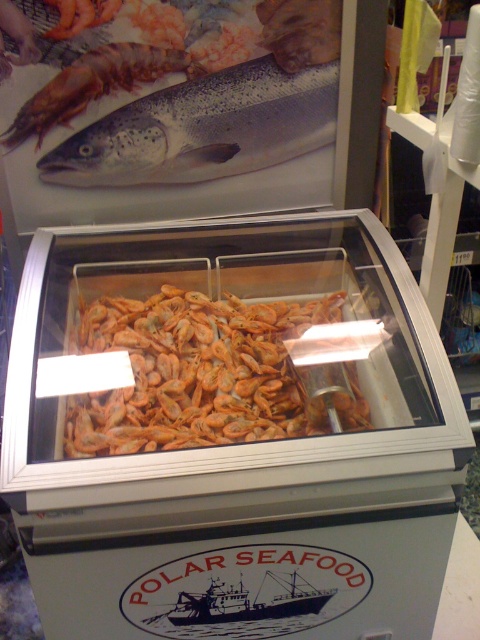
You are a customer at a seafood market and want to pick up the shiny orange prawn at upper left and orange matte prawns at center. If your hand can reach 25 inches, can you grab both without moving your hand?

The distance between the orange matte prawns at center and the shiny orange prawn at upper left is 28.00 inches. Since your hand can only reach 25 inches, you cannot grab both without moving your hand.

You are a customer at the seafood counter and want to buy the orange matte prawns at center. The cashier says they are behind the shiny silver fish at upper center. Is the cashier telling the truth?

The orange matte prawns at center is positioned under the shiny silver fish at upper center, so the cashier is telling the truth because the prawns are indeed located behind the fish in the display case.